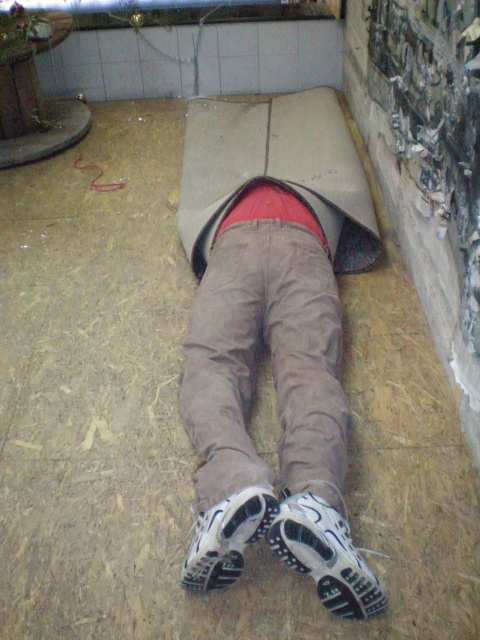
Question: Does white mesh shoe at lower center appear under white matte shoe at lower center?

Choices:
 (A) yes
 (B) no

Answer: (A)

Question: Among these points, which one is nearest to the camera?

Choices:
 (A) (236, 512)
 (B) (370, 568)

Answer: (A)

Question: Where is white mesh shoe at lower center located in relation to white matte shoe at lower center in the image?

Choices:
 (A) above
 (B) below

Answer: (B)

Question: Does white mesh shoe at lower center appear on the left side of white matte shoe at lower center?

Choices:
 (A) yes
 (B) no

Answer: (B)